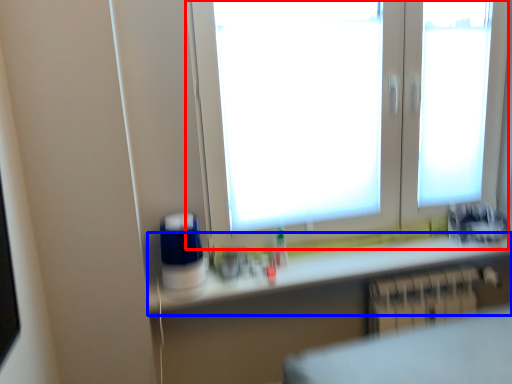
Question: Which point is further to the camera, window (highlighted by a red box) or counter top (highlighted by a blue box)?

Choices:
 (A) window
 (B) counter top

Answer: (B)